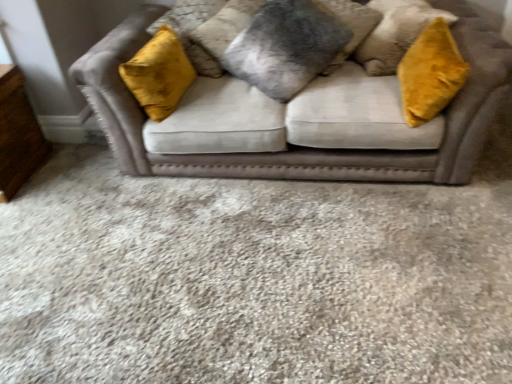
Question: Should I look upward or downward to see fuzzy gray pillow at center, which is the second pillow in right-to-left order?

Choices:
 (A) down
 (B) up

Answer: (B)

Question: Is velvet gray pillow at center, the first pillow viewed from the right, to the left of velvet beige sofa at center from the viewer's perspective?

Choices:
 (A) no
 (B) yes

Answer: (A)

Question: Could you tell me if velvet gray pillow at center, the first pillow viewed from the right, is facing velvet beige sofa at center?

Choices:
 (A) yes
 (B) no

Answer: (B)

Question: Does velvet gray pillow at center, the first pillow viewed from the right, have a larger size compared to velvet beige sofa at center?

Choices:
 (A) no
 (B) yes

Answer: (A)

Question: From a real-world perspective, is velvet gray pillow at center, the first pillow viewed from the right, beneath velvet beige sofa at center?

Choices:
 (A) yes
 (B) no

Answer: (B)

Question: Does velvet gray pillow at center, placed as the second pillow when sorted from left to right, have a smaller size compared to velvet beige sofa at center?

Choices:
 (A) yes
 (B) no

Answer: (A)

Question: Is velvet gray pillow at center, placed as the second pillow when sorted from left to right, thinner than velvet beige sofa at center?

Choices:
 (A) yes
 (B) no

Answer: (A)

Question: Is wooden dresser at lower left located within velvet gray pillow at center, placed as the second pillow when sorted from left to right?

Choices:
 (A) no
 (B) yes

Answer: (A)

Question: Is velvet gray pillow at center, placed as the second pillow when sorted from left to right, bigger than wooden dresser at lower left?

Choices:
 (A) no
 (B) yes

Answer: (B)

Question: Considering the relative sizes of velvet gray pillow at center, placed as the second pillow when sorted from left to right, and wooden dresser at lower left in the image provided, is velvet gray pillow at center, placed as the second pillow when sorted from left to right, wider than wooden dresser at lower left?

Choices:
 (A) yes
 (B) no

Answer: (B)

Question: Can you confirm if velvet gray pillow at center, placed as the second pillow when sorted from left to right, is positioned to the right of wooden dresser at lower left?

Choices:
 (A) no
 (B) yes

Answer: (B)

Question: Can you confirm if velvet gray pillow at center, the first pillow viewed from the right, is taller than wooden dresser at lower left?

Choices:
 (A) yes
 (B) no

Answer: (B)

Question: Is velvet gray pillow at center, the first pillow viewed from the right, to the left of wooden dresser at lower left from the viewer's perspective?

Choices:
 (A) yes
 (B) no

Answer: (B)

Question: Can you confirm if wooden dresser at lower left is taller than velvet beige couch at center?

Choices:
 (A) no
 (B) yes

Answer: (A)